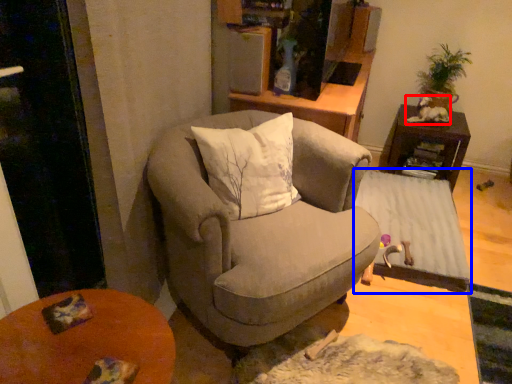
Question: Among these objects, which one is nearest to the camera, animal (highlighted by a red box) or table (highlighted by a blue box)?

Choices:
 (A) animal
 (B) table

Answer: (B)